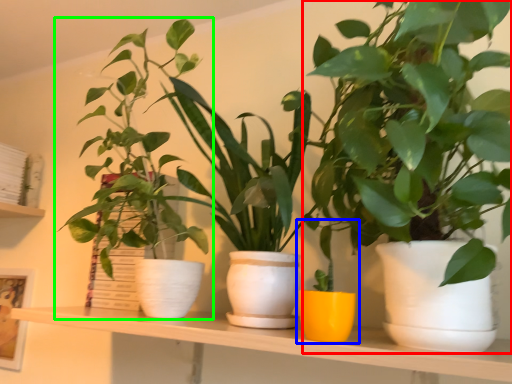
Question: Which object is positioned closest to houseplant (highlighted by a red box)? Select from houseplant (highlighted by a blue box) and houseplant (highlighted by a green box).

Choices:
 (A) houseplant
 (B) houseplant

Answer: (A)